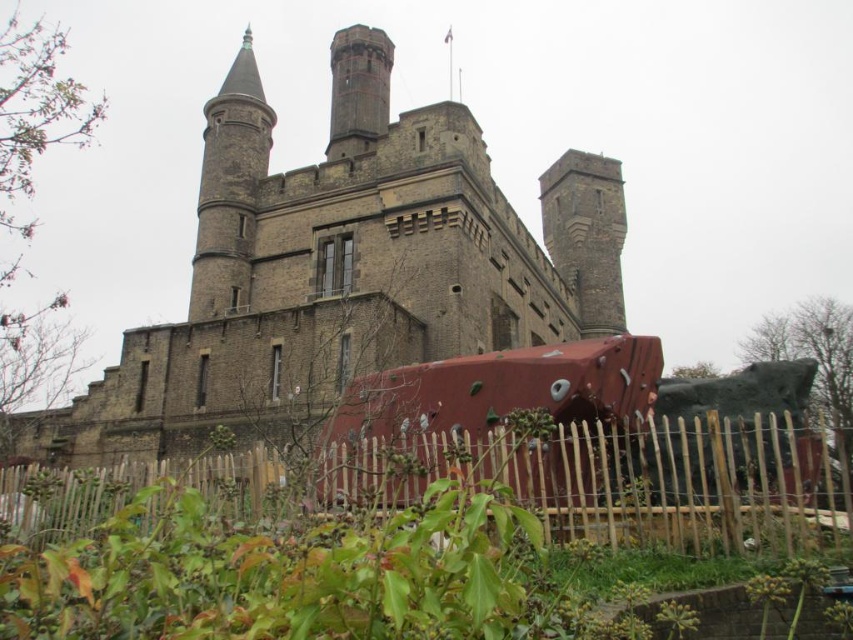
Question: Which point is closer to the camera taking this photo?

Choices:
 (A) (576, 224)
 (B) (375, 70)
 (C) (587, 476)

Answer: (C)

Question: Is rustic metal train car at center smaller than gray stone tower at upper center?

Choices:
 (A) no
 (B) yes

Answer: (B)

Question: Can you confirm if wooden picket fence at lower center is wider than gray stone tower at upper center?

Choices:
 (A) yes
 (B) no

Answer: (A)

Question: Which object appears closest to the camera in this image?

Choices:
 (A) rustic metal train car at center
 (B) dark gray stone tower at upper center
 (C) wooden picket fence at lower center
 (D) gray stone tower at upper center

Answer: (C)

Question: Can you confirm if rustic metal train car at center is wider than dark gray stone tower at upper center?

Choices:
 (A) yes
 (B) no

Answer: (A)

Question: Which point is closer to the camera?

Choices:
 (A) [x=490, y=467]
 (B) [x=569, y=200]
 (C) [x=358, y=472]

Answer: (A)